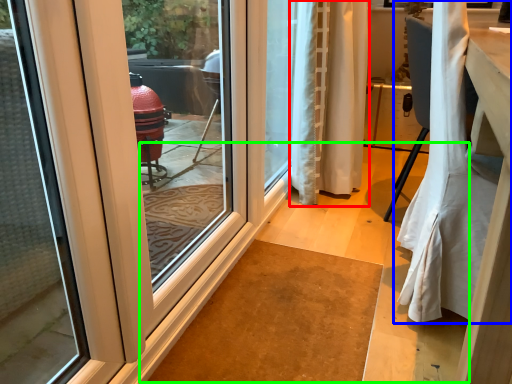
Question: Estimate the real-world distances between objects in this image. Which object is farther from curtain (highlighted by a red box), curtain (highlighted by a blue box) or path (highlighted by a green box)?

Choices:
 (A) curtain
 (B) path

Answer: (A)